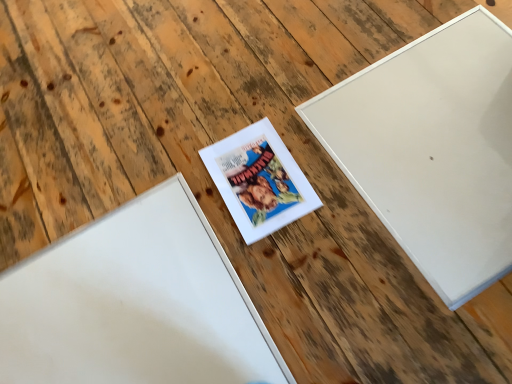
Where is `free space above white matte picture frame at center, the 3th picture frame in the right-to-left sequence (from a real-world perspective)`? This screenshot has height=384, width=512. free space above white matte picture frame at center, the 3th picture frame in the right-to-left sequence (from a real-world perspective) is located at coordinates (119, 312).